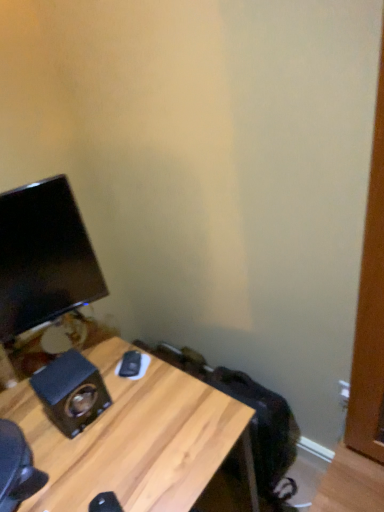
Question: Would you say wooden grain speaker at lower left is part of black glossy monitor at left's contents?

Choices:
 (A) yes
 (B) no

Answer: (B)

Question: Is black glossy monitor at left wider than wooden grain speaker at lower left?

Choices:
 (A) no
 (B) yes

Answer: (A)

Question: Is black glossy monitor at left positioned with its back to wooden grain speaker at lower left?

Choices:
 (A) no
 (B) yes

Answer: (A)

Question: Is black glossy monitor at left to the right of wooden grain speaker at lower left from the viewer's perspective?

Choices:
 (A) no
 (B) yes

Answer: (A)

Question: Considering the relative sizes of black glossy monitor at left and wooden grain speaker at lower left in the image provided, is black glossy monitor at left taller than wooden grain speaker at lower left?

Choices:
 (A) yes
 (B) no

Answer: (A)

Question: Is black glossy monitor at left oriented towards wooden grain speaker at lower left?

Choices:
 (A) no
 (B) yes

Answer: (A)

Question: Is wooden desk at lower left next to wooden grain speaker at lower left and touching it?

Choices:
 (A) yes
 (B) no

Answer: (B)

Question: Does wooden desk at lower left come in front of wooden grain speaker at lower left?

Choices:
 (A) no
 (B) yes

Answer: (B)

Question: From a real-world perspective, is wooden desk at lower left physically above wooden grain speaker at lower left?

Choices:
 (A) yes
 (B) no

Answer: (B)

Question: Is wooden desk at lower left at the left side of wooden grain speaker at lower left?

Choices:
 (A) yes
 (B) no

Answer: (B)

Question: From the image's perspective, is wooden desk at lower left on wooden grain speaker at lower left?

Choices:
 (A) yes
 (B) no

Answer: (B)

Question: Can you confirm if wooden desk at lower left is smaller than wooden grain speaker at lower left?

Choices:
 (A) no
 (B) yes

Answer: (A)

Question: Is wooden grain speaker at lower left thinner than black glossy monitor at left?

Choices:
 (A) yes
 (B) no

Answer: (B)